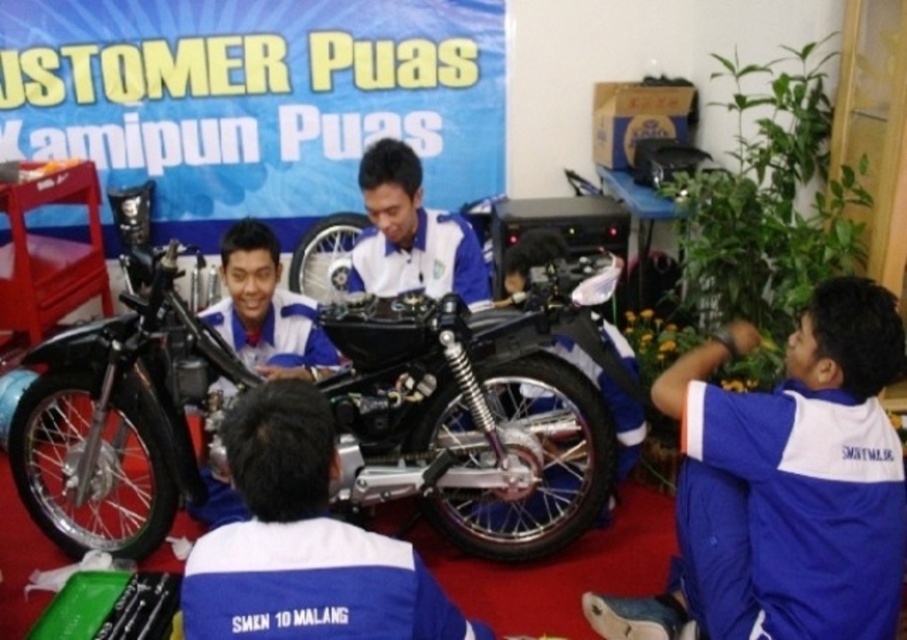
Question: Among these objects, which one is nearest to the camera?

Choices:
 (A) blue fabric shirt at center
 (B) blue/white uniform at center
 (C) shiny black motorcycle at center

Answer: (C)

Question: Does shiny black motorcycle at center appear on the left side of blue jersey at lower right?

Choices:
 (A) yes
 (B) no

Answer: (A)

Question: Which object appears closest to the camera in this image?

Choices:
 (A) shiny black motorcycle at center
 (B) blue jersey at lower right
 (C) blue fabric shirt at center
 (D) blue/white uniform at center

Answer: (B)

Question: Observing the image, what is the correct spatial positioning of blue jersey at lower right in reference to blue fabric shirt at center?

Choices:
 (A) below
 (B) above

Answer: (A)

Question: Among these points, which one is farthest from the camera?

Choices:
 (A) (822, 620)
 (B) (106, 467)

Answer: (B)

Question: Does shiny black motorcycle at center appear on the left side of blue fabric shirt at center?

Choices:
 (A) yes
 (B) no

Answer: (A)